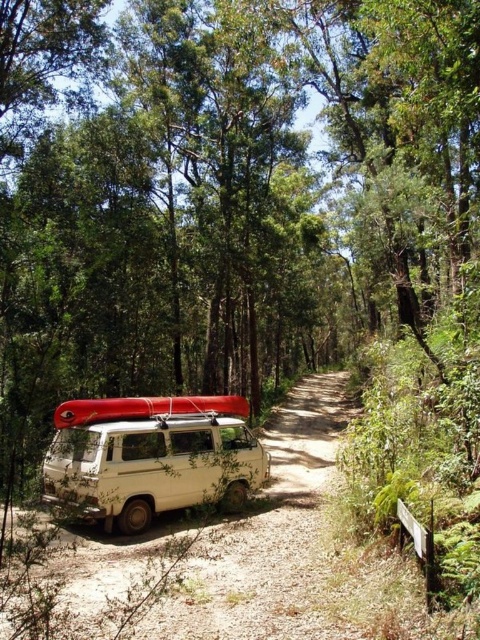
Is point (160, 483) less distant than point (237, 404)?

Yes.

Does white matte van at center appear on the right side of rubberized red canoe at center?

Yes, white matte van at center is to the right of rubberized red canoe at center.

Where is `white matte van at center`? Image resolution: width=480 pixels, height=640 pixels. white matte van at center is located at coordinates (153, 465).